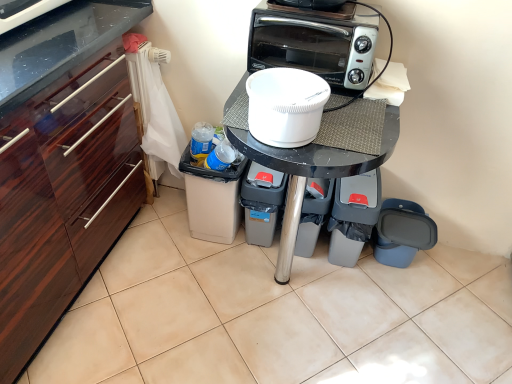
Question: From a real-world perspective, is black glossy table at center physically located above or below white plastic container at center?

Choices:
 (A) below
 (B) above

Answer: (A)

Question: In terms of height, does black glossy table at center look taller or shorter compared to white plastic container at center?

Choices:
 (A) short
 (B) tall

Answer: (B)

Question: Based on their relative distances, which object is farther from the black glossy table at center?

Choices:
 (A) gray plastic trash can at lower right, which ranks as the 3th appliance in left-to-right order
 (B) white plastic container at center
 (C) blue plastic trash can at lower right, which appears as the fourth appliance when viewed from the left
 (D) silver metallic toaster oven at upper center
 (E) gray plastic trash can at lower center, which is the 3th appliance in right-to-left order

Answer: (C)

Question: Estimate the real-world distances between objects in this image. Which object is closer to the white plastic container at center?

Choices:
 (A) silver metallic toaster oven at upper center
 (B) gray plastic trash can at lower center, positioned as the 2th appliance in left-to-right order
 (C) blue plastic trash can at lower right, which appears as the fourth appliance when viewed from the left
 (D) black glossy table at center
 (E) gray plastic trash bin at lower center, which is counted as the 4th appliance, starting from the right

Answer: (D)